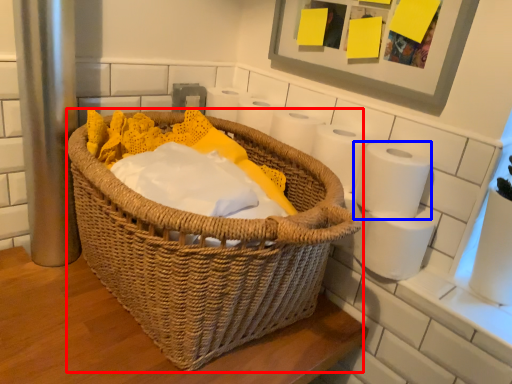
Question: Which of the following is the closest to the observer, picnic basket (highlighted by a red box) or toilet paper (highlighted by a blue box)?

Choices:
 (A) picnic basket
 (B) toilet paper

Answer: (A)